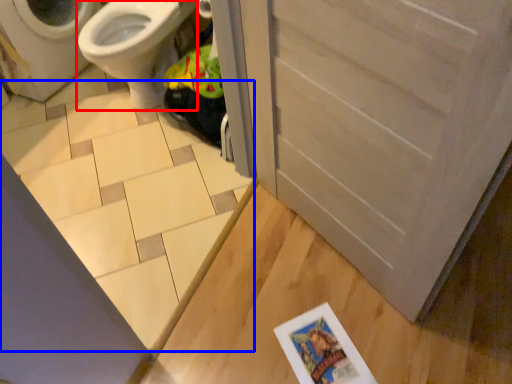
Question: Among these objects, which one is farthest to the camera, bidet (highlighted by a red box) or tile (highlighted by a blue box)?

Choices:
 (A) bidet
 (B) tile

Answer: (A)